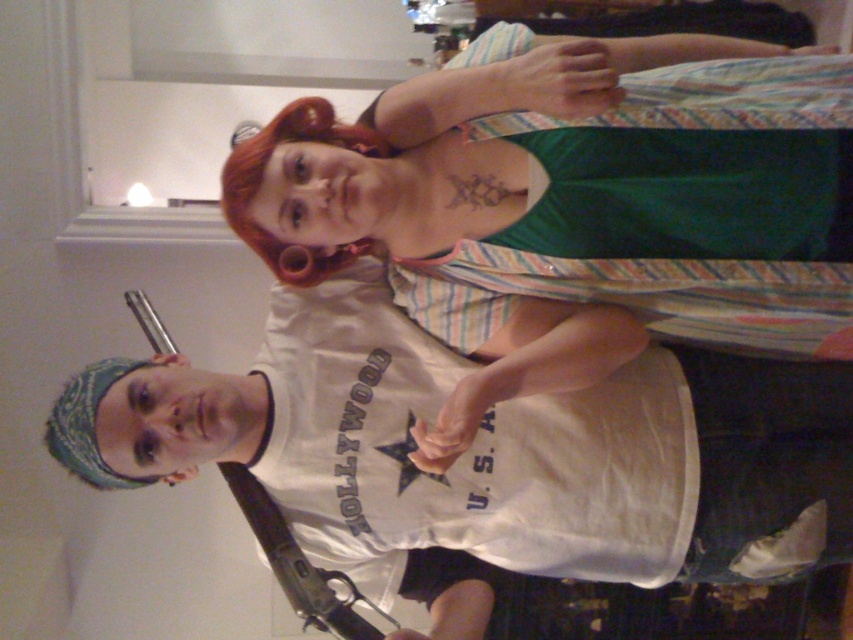
You are standing in the room and want to find the white cotton shirt at center. According to the coordinates given, where would you look relative to the room?

The white cotton shirt at center is located at the coordinates point (x=573, y=205), which would be slightly to the left and lower center of the room.